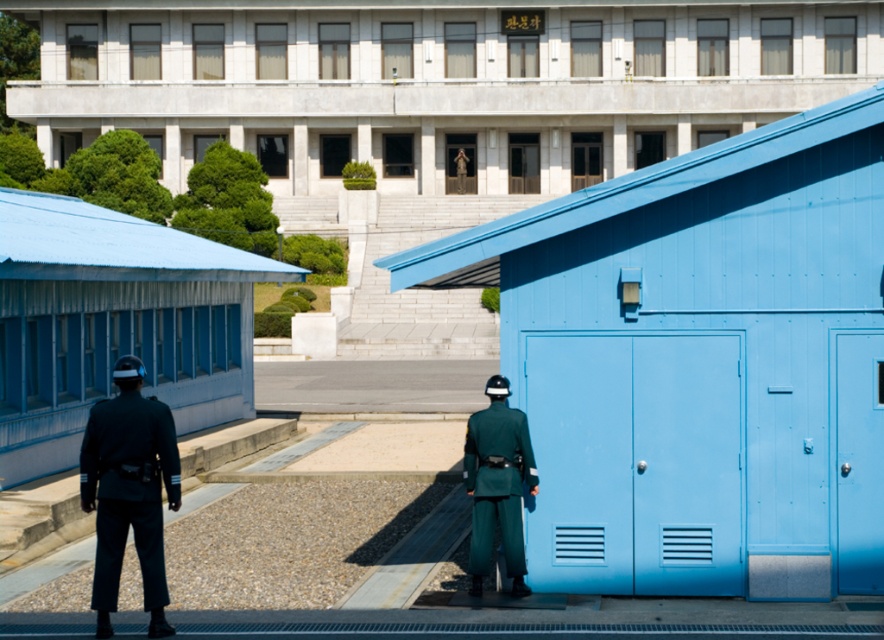
You are a drone operator trying to navigate a small drone between two points in the checkpoint scene. The first point is point [118,576] and the second is point [514,433]. Since the drone must fly over the blue metal structures, which are between these points, will the drone have to ascend or descend when moving from the first point to the second?

The point [118,576] is in front of point [514,433]. Since the blue metal structures are between them, the drone will have to ascend when moving from the first point to the second to avoid collision with the structures.

Based on the photo, you are a drone operator trying to navigate between two points in the checkpoint area. The first point is at coordinates point (787, 362) and the second point is at coordinates point (337, 1). Which point is nearer to your current position as the drone?

Point (787, 362) is closer to the viewer than point (337, 1), so the first point is nearer to your current position as the drone.